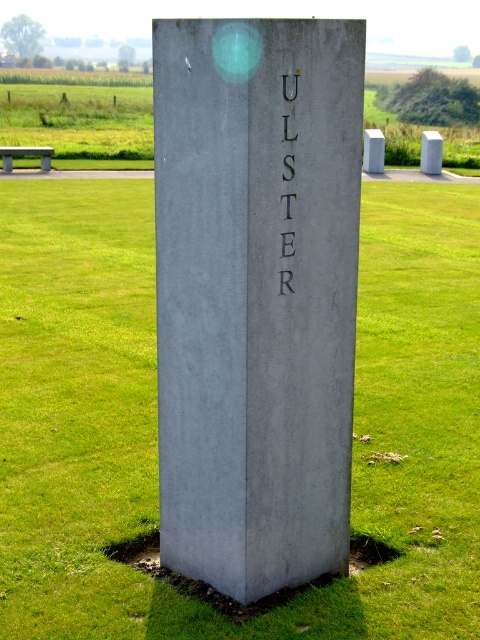
Question: Does gray concrete monument at center have a greater width compared to black metal text at center?

Choices:
 (A) no
 (B) yes

Answer: (B)

Question: Can you confirm if gray concrete monument at center is positioned to the right of black metal text at center?

Choices:
 (A) yes
 (B) no

Answer: (B)

Question: Which object is the farthest from the gray concrete monument at center?

Choices:
 (A) green grass at center
 (B) black metal text at center

Answer: (A)

Question: Which object is farther from the camera taking this photo?

Choices:
 (A) gray concrete monument at center
 (B) black metal text at center

Answer: (B)

Question: Does gray concrete monument at center appear on the left side of black metal text at center?

Choices:
 (A) no
 (B) yes

Answer: (B)

Question: Which point appears farthest from the camera in this image?

Choices:
 (A) (288, 99)
 (B) (410, 630)
 (C) (280, 49)

Answer: (B)